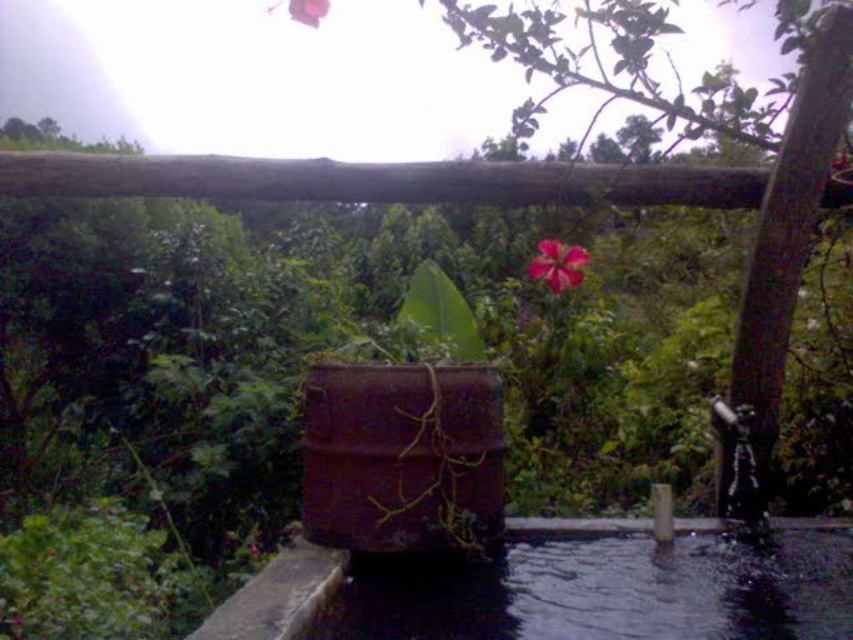
Question: Among these points, which one is farthest from the camera?

Choices:
 (A) (527, 624)
 (B) (541, 244)

Answer: (B)

Question: Is clear water at bottom above pink matte flower at upper center?

Choices:
 (A) no
 (B) yes

Answer: (A)

Question: Is clear water at bottom in front of pink matte flower at upper center?

Choices:
 (A) yes
 (B) no

Answer: (A)

Question: Can you confirm if clear water at bottom is positioned to the right of pink matte flower at upper center?

Choices:
 (A) no
 (B) yes

Answer: (B)

Question: Which point is farther to the camera?

Choices:
 (A) pink matte flower at upper center
 (B) clear water at bottom

Answer: (A)